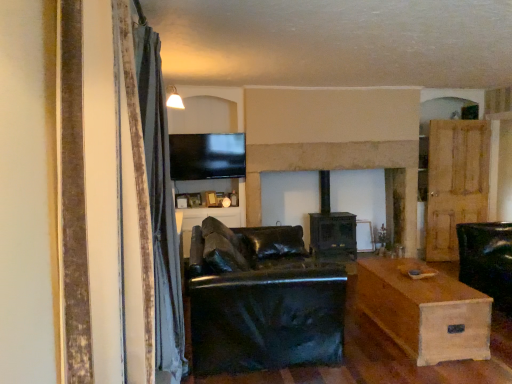
Question: Is light brown wooden table at lower right positioned with its back to stone fireplace at center?

Choices:
 (A) no
 (B) yes

Answer: (A)

Question: From a real-world perspective, is light brown wooden table at lower right on stone fireplace at center?

Choices:
 (A) no
 (B) yes

Answer: (A)

Question: Does light brown wooden table at lower right have a lesser width compared to stone fireplace at center?

Choices:
 (A) yes
 (B) no

Answer: (A)

Question: Is light brown wooden table at lower right positioned in front of stone fireplace at center?

Choices:
 (A) yes
 (B) no

Answer: (A)

Question: From a real-world perspective, is light brown wooden table at lower right below stone fireplace at center?

Choices:
 (A) no
 (B) yes

Answer: (B)

Question: Is light brown wooden table at lower right facing towards stone fireplace at center?

Choices:
 (A) yes
 (B) no

Answer: (B)

Question: Can you confirm if wooden door at right is shorter than light brown wooden table at lower right?

Choices:
 (A) yes
 (B) no

Answer: (B)

Question: Are wooden door at right and light brown wooden table at lower right making contact?

Choices:
 (A) yes
 (B) no

Answer: (B)

Question: Can you confirm if wooden door at right is smaller than light brown wooden table at lower right?

Choices:
 (A) no
 (B) yes

Answer: (B)

Question: Is wooden door at right facing away from light brown wooden table at lower right?

Choices:
 (A) no
 (B) yes

Answer: (A)

Question: Is wooden door at right at the right side of light brown wooden table at lower right?

Choices:
 (A) no
 (B) yes

Answer: (B)

Question: Does wooden door at right have a greater width compared to light brown wooden table at lower right?

Choices:
 (A) no
 (B) yes

Answer: (A)

Question: Can you confirm if stone fireplace at center is taller than flat screen tv at upper center?

Choices:
 (A) yes
 (B) no

Answer: (A)